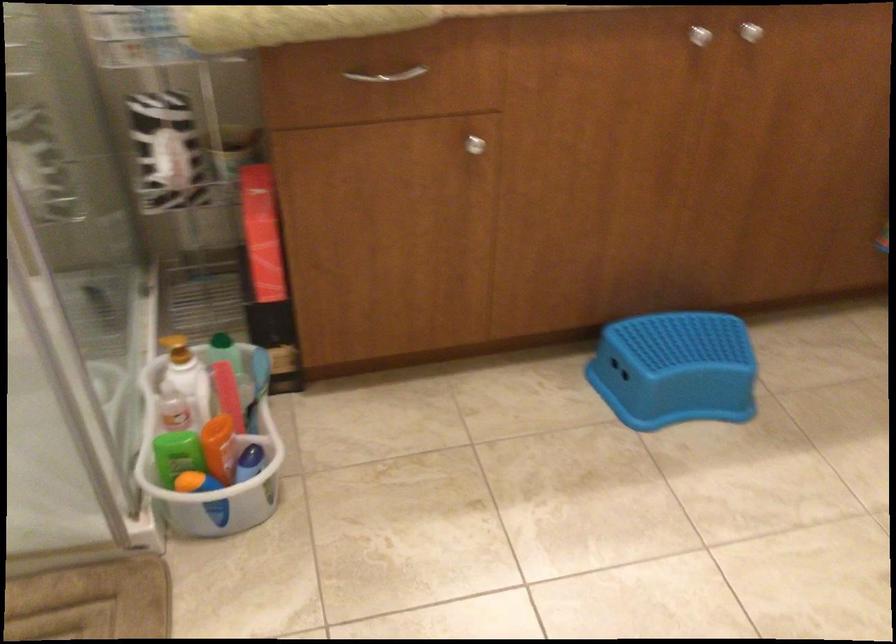
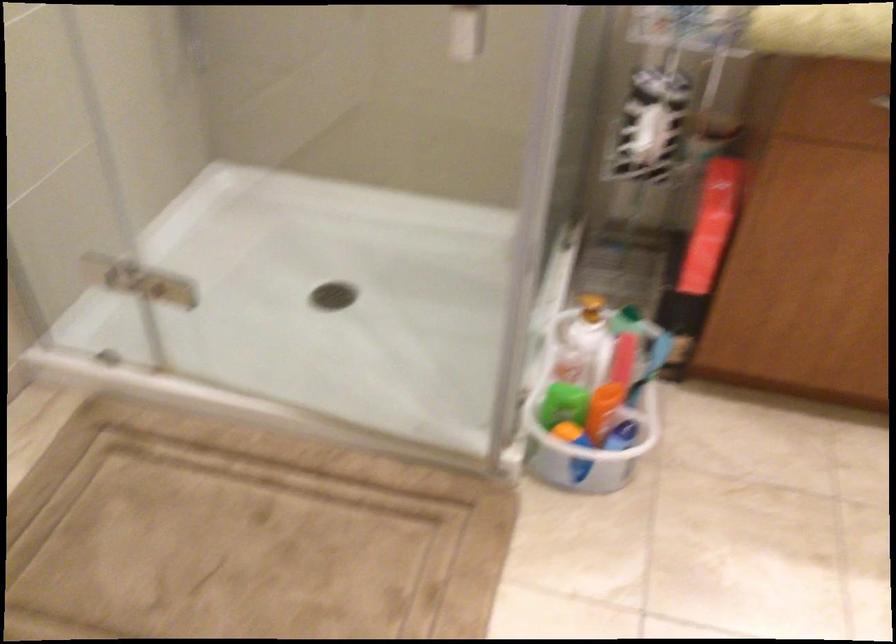
Question: Based on the continuous images, in which direction is the camera rotating? Reply with the corresponding letter.

Choices:
 (A) Left
 (B) Right
 (C) Up
 (D) Down

Answer: (A)